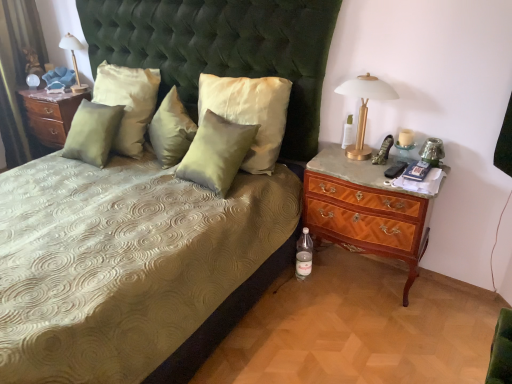
Identify the location of vacant area situated to the left side of translucent glass candle holder at right. (362, 164).